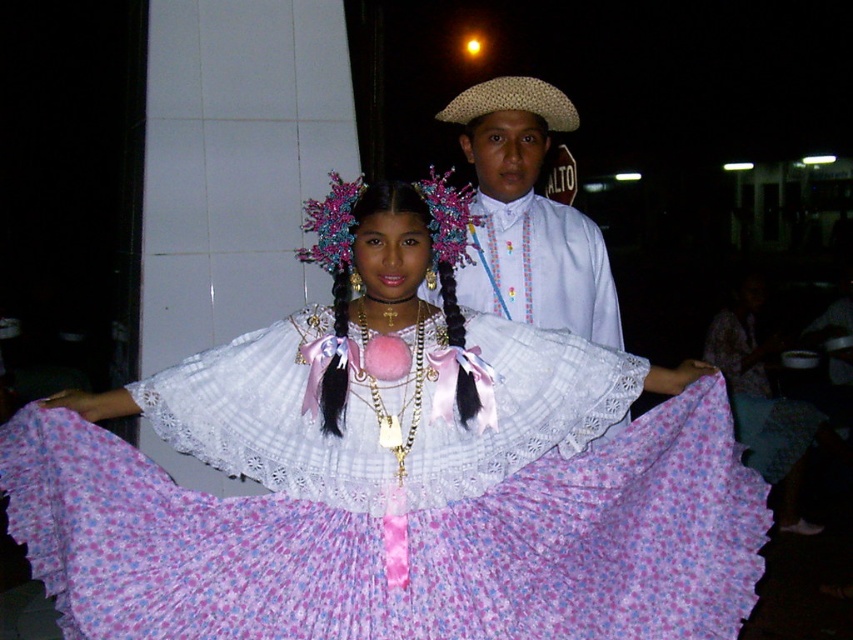
You are planning to take a photo of the two people in the scene. The floral chiffon dress at center and the white woven hat at center are both in the frame. Which object will appear bigger in the photo?

The floral chiffon dress at center will appear bigger in the photo because it has a larger size compared to the white woven hat at center.

You are attending a cultural festival and see two items at the center of the scene. The pink fabric floral crown at center and the natural straw hat at center. Which one is closer to you?

The pink fabric floral crown at center is closer to you because it is in front of the natural straw hat at center.

You are a photographer at the cultural event and need to position two hats correctly for a photo. The scene has a young girl in a purple dress and an adult male in a light blue shirt. You must place the white woven hat at center and the natural straw hat at center in the image. According to the description, which hat should be placed to the right of the other?

The white woven hat at center should be placed to the right of the natural straw hat at center.